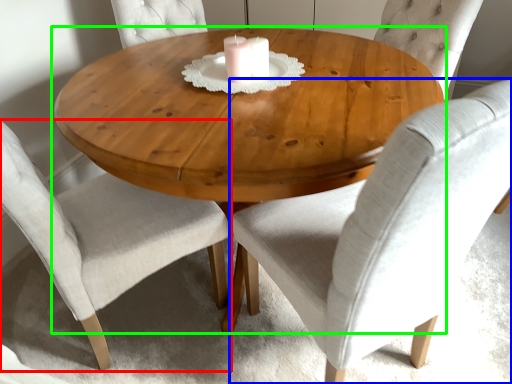
Question: Which is farther away from chair (highlighted by a red box)? chair (highlighted by a blue box) or coffee table (highlighted by a green box)?

Choices:
 (A) chair
 (B) coffee table

Answer: (A)